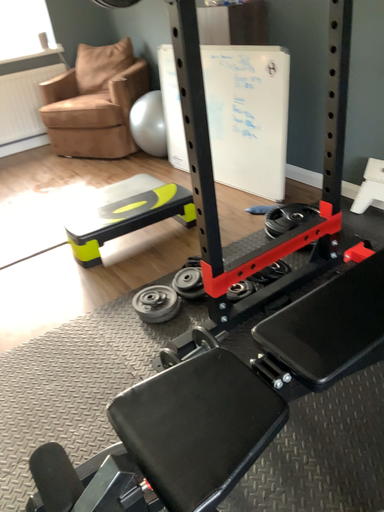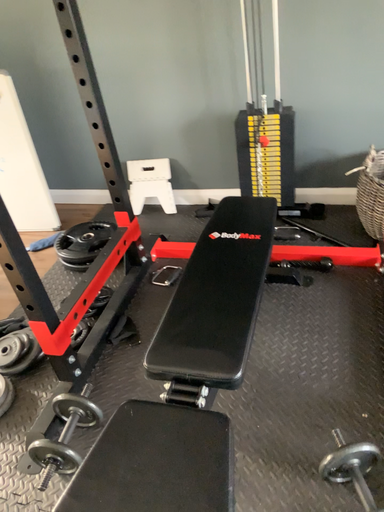
Question: Which way did the camera rotate in the video?

Choices:
 (A) rotated left
 (B) rotated right

Answer: (B)